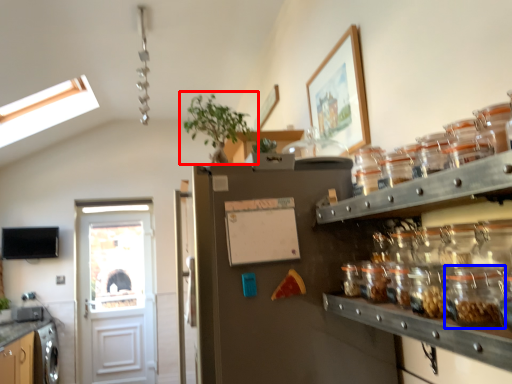
Question: Which object appears farthest to the camera in this image, houseplant (highlighted by a red box) or glass jar (highlighted by a blue box)?

Choices:
 (A) houseplant
 (B) glass jar

Answer: (A)